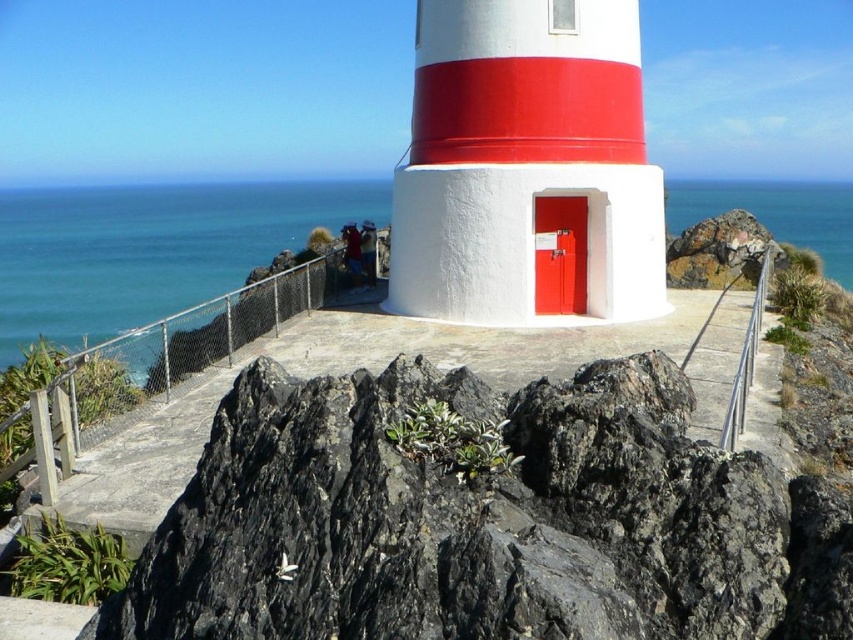
Does black rock at center have a lesser height compared to blue water at upper center?

Yes.

Is point (280, 483) closer to viewer compared to point (816, 200)?

Yes, point (280, 483) is closer to viewer.

You are a GUI agent. You are given a task and a screenshot of the screen. Output one action in this format:
    pyautogui.click(x=<x>, y=<y>)
    Task: Click on the black rock at center
    This screenshot has height=640, width=853.
    Given the screenshot: What is the action you would take?
    pyautogui.click(x=485, y=518)